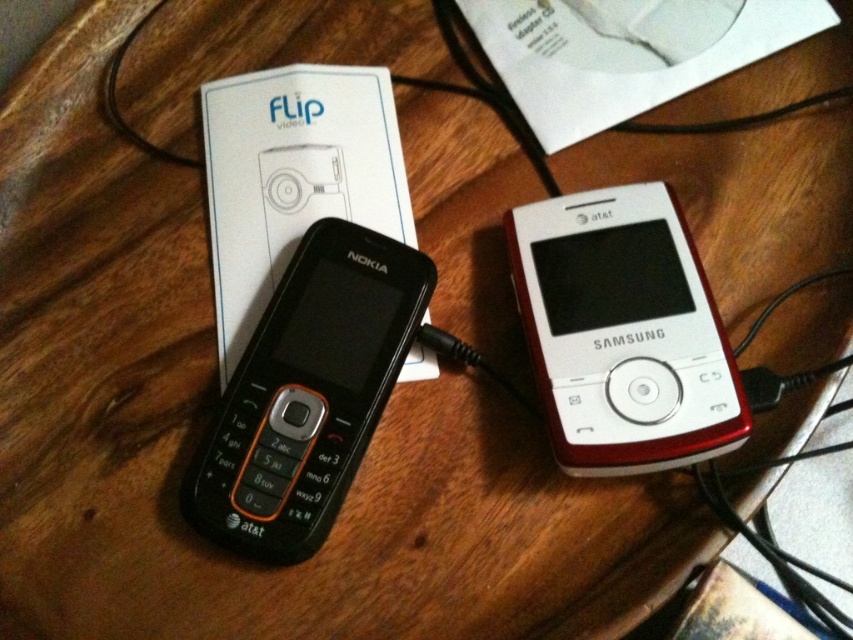
You are a delivery person who needs to place a new phone charger between the white glossy ipod at center and the black plastic nokia phone at center. The charger is 5 inches long. Can you fit it between them without moving the ipod or the phone?

The distance between the white glossy ipod at center and the black plastic nokia phone at center is 10.24 inches. Since the charger is only 5 inches long, it can easily be placed between them without needing to move either device.

You are a delivery person who needs to place a new white glossy iPod at the center of the wooden surface where the two old phones are. The coordinates given are point (624, 332). Based on the scene, where exactly should you place the new iPod?

The point (624, 332) corresponds to the center of the wooden surface where the two old phones are located. Therefore, you should place the new white glossy iPod at that central position to match the coordinates provided.

You are a delivery person who needs to place a new package on the wooden surface where the two phones are located. The package must be placed exactly at point (624,332). However, there is an object already present at that location. What object is blocking the placement of the package?

The white glossy ipod at center is blocking the placement of the package at point (624,332).